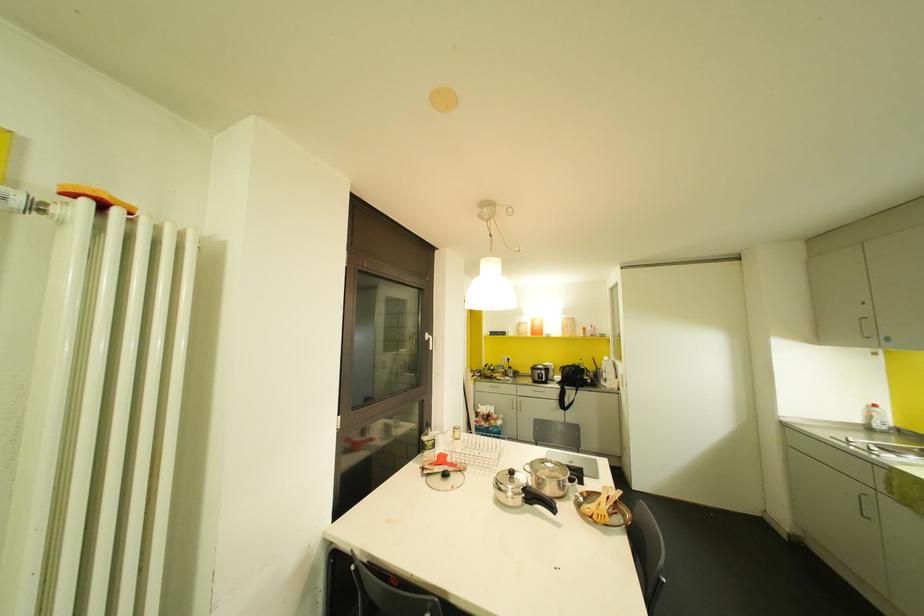
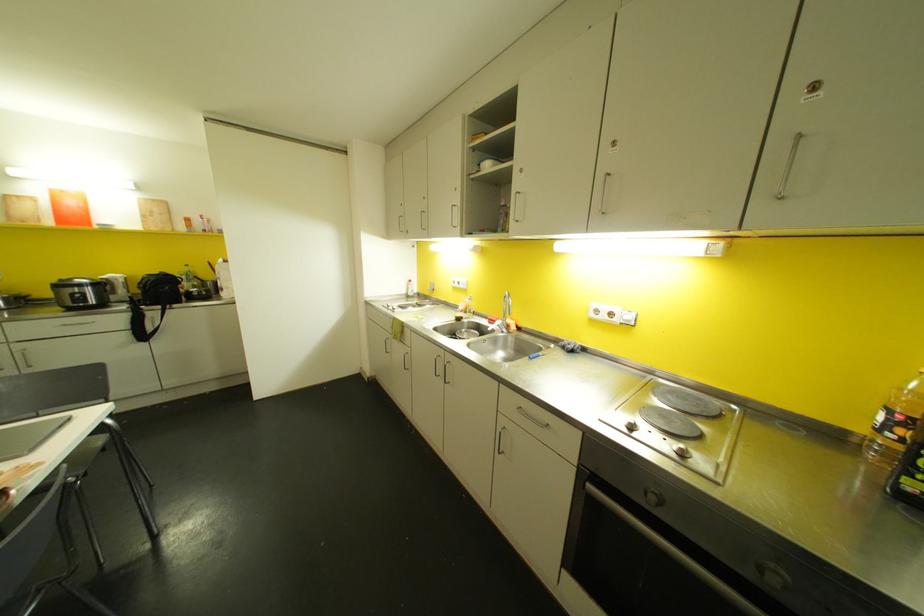
The first image is from the beginning of the video and the second image is from the end. How did the camera likely rotate when shooting the video?

The camera rotated toward right-down.